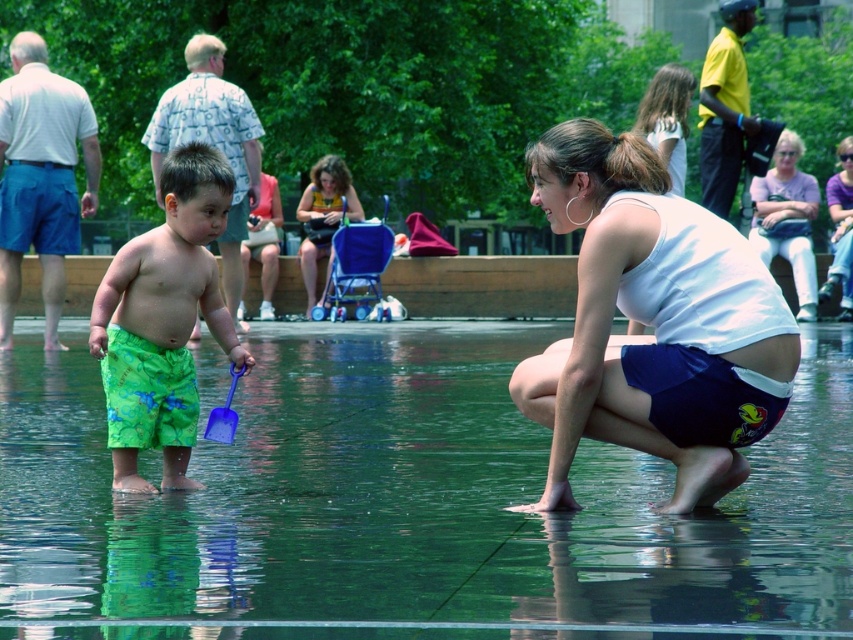
You are a photographer trying to capture a clear shot of the matte yellow tank top at center and the blue plastic shovel at lower center. Which object should you focus on first to ensure both are in focus?

The matte yellow tank top at center is positioned over the blue plastic shovel at lower center, so focusing on the matte yellow tank top at center first will help ensure both are in focus since it is closer to the camera.

You are standing in the outdoor water feature scene. There are two points marked in the image. The first point is at coordinates point [410,470] and the second is at point [161,224]. Which point is closer to your current position?

Point [410,470] is closer to the camera than point [161,224], so the first point is closer to your current position.